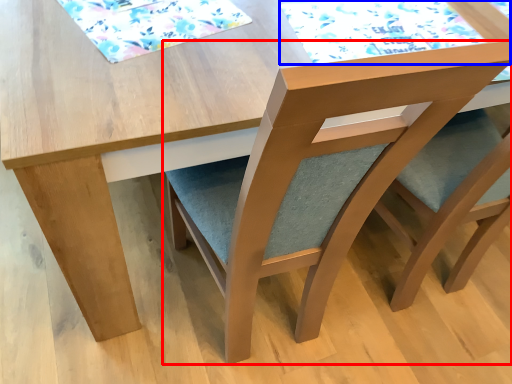
Question: Which object appears closest to the camera in this image, chair (highlighted by a red box) or mat (highlighted by a blue box)?

Choices:
 (A) chair
 (B) mat

Answer: (A)